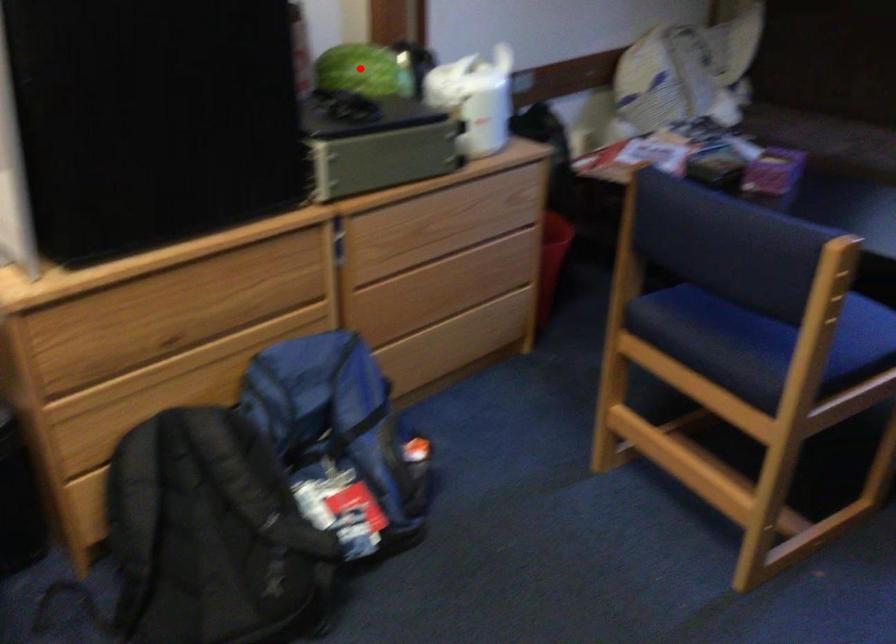
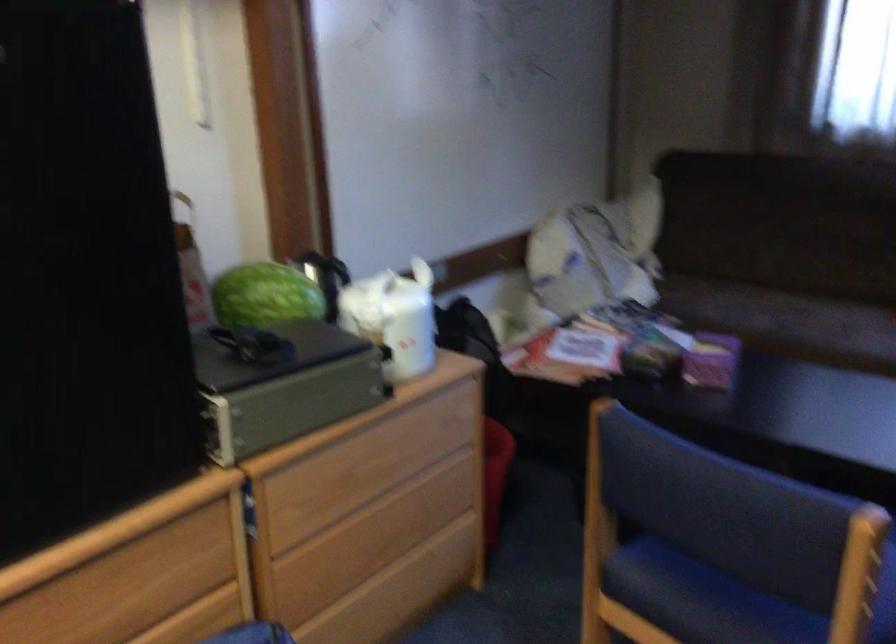
Question: I am providing you with two images of the same scene from different viewpoints. Image1 has a red point marked. In image2, the corresponding 3D location appears at what relative position? Reply with the corresponding letter.

Choices:
 (A) Closer
 (B) Farther

Answer: (A)